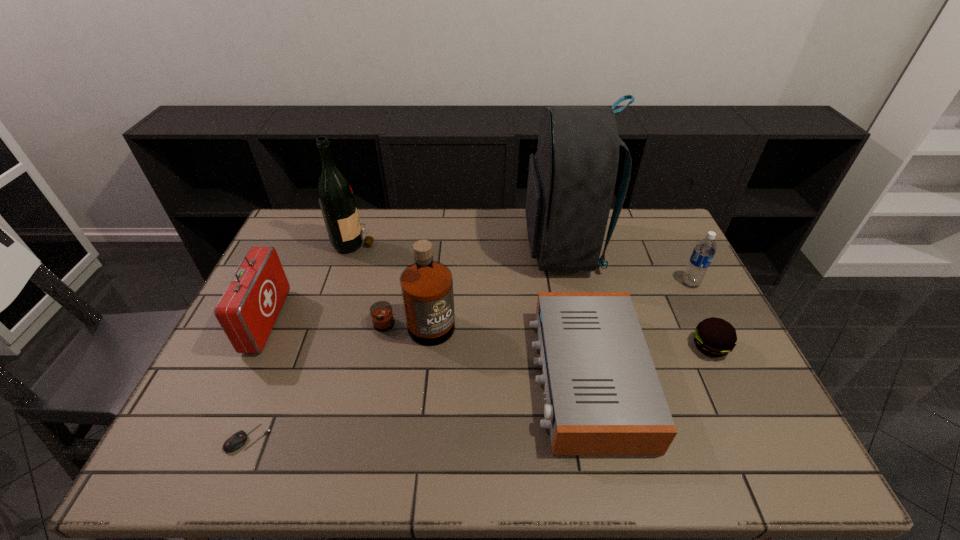
Where is `free region located 0.330m on the right of the mouse`? The width and height of the screenshot is (960, 540). free region located 0.330m on the right of the mouse is located at coordinates (413, 438).

Image resolution: width=960 pixels, height=540 pixels. Find the location of `backpack situated at the far edge`. backpack situated at the far edge is located at coordinates (571, 179).

You are a GUI agent. You are given a task and a screenshot of the screen. Output one action in this format:
    pyautogui.click(x=<x>, y=<y>)
    Task: Click on the wine bottle located in the far edge section of the desktop
    The height and width of the screenshot is (540, 960).
    Given the screenshot: What is the action you would take?
    pyautogui.click(x=335, y=195)

The image size is (960, 540). In order to click on radio receiver at the near edge in this screenshot , I will do coord(603,396).

Identify the location of mouse that is at the near edge. (236, 441).

This screenshot has width=960, height=540. I want to click on the first-aid kit at the left edge, so click(248, 309).

At what (x,y) coordinates should I click in order to perform the action: click on mouse at the left edge. Please return your answer as a coordinate pair (x, y). The image size is (960, 540). Looking at the image, I should click on (236, 441).

Find the location of a particular element. This screenshot has width=960, height=540. water bottle that is at the right edge is located at coordinates (704, 251).

Where is `patty positioned at the right edge`? patty positioned at the right edge is located at coordinates (714, 337).

Locate an element on the screen. The width and height of the screenshot is (960, 540). object at the near left corner is located at coordinates (236, 441).